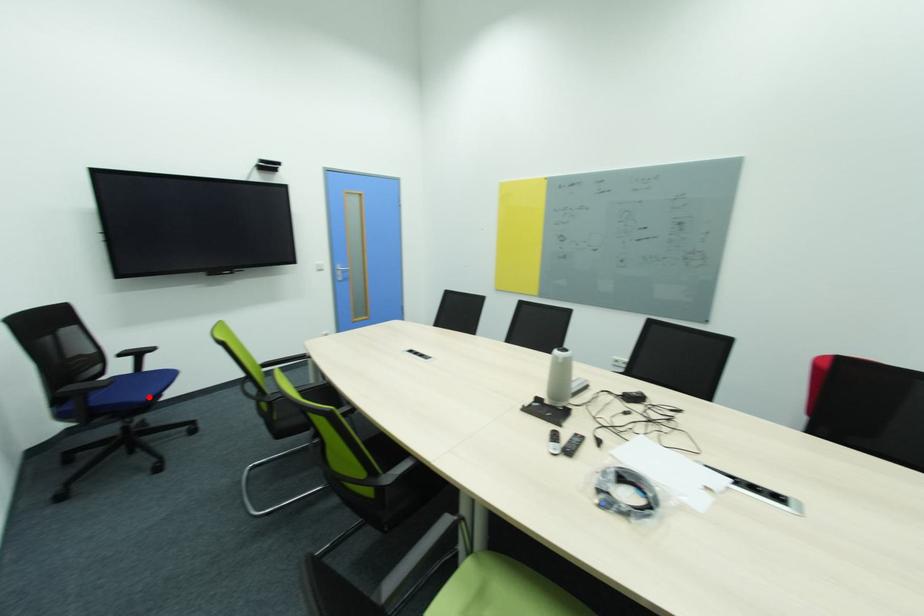
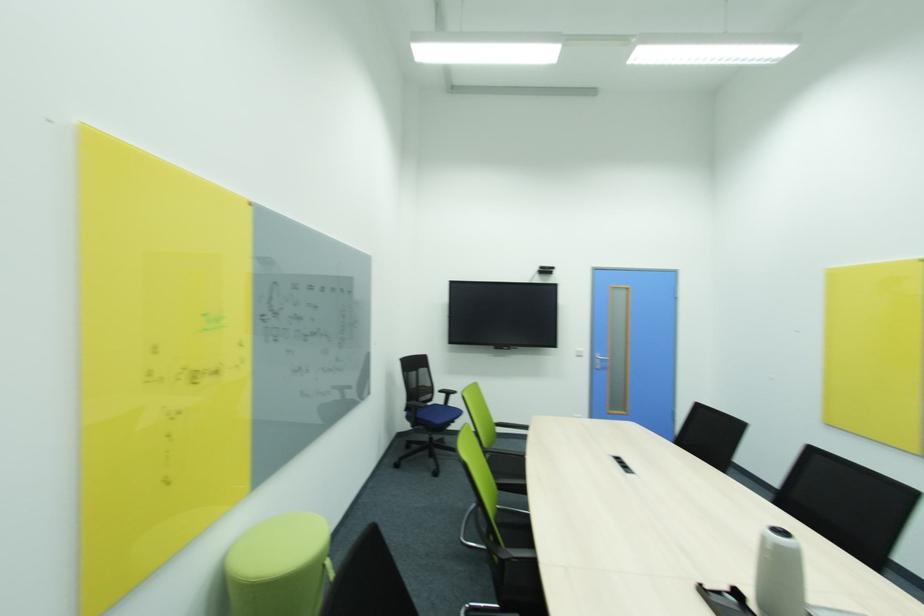
In the second image, find the point that corresponds to the highlighted location in the first image.

(442, 422)